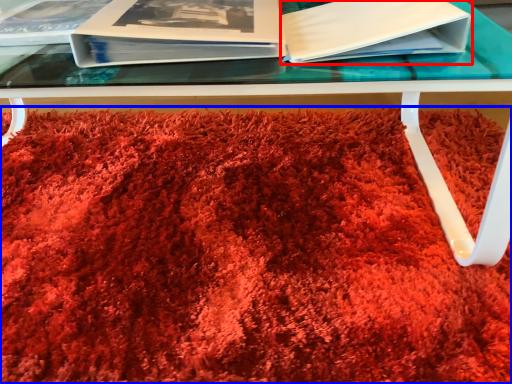
Question: Which object is further to the camera taking this photo, paperback book (highlighted by a red box) or blanket (highlighted by a blue box)?

Choices:
 (A) paperback book
 (B) blanket

Answer: (A)